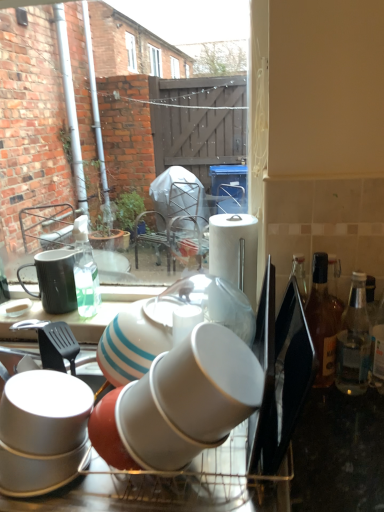
Locate an element on the screen. vacant space in front of clear glass bottle at right, the first bottle in the right-to-left sequence is located at coordinates (345, 430).